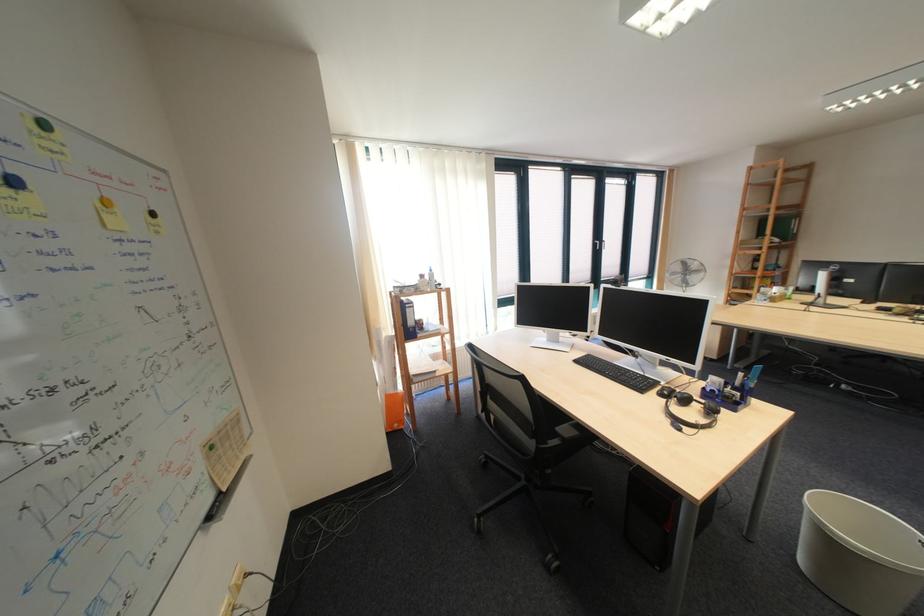
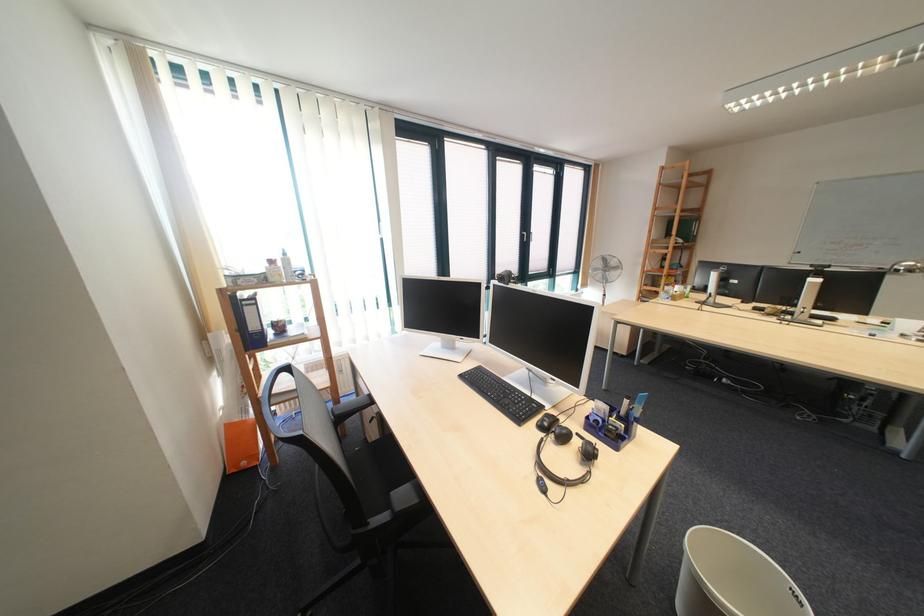
In the second image, find the point that corresponds to (695,422) in the first image.

(563, 476)